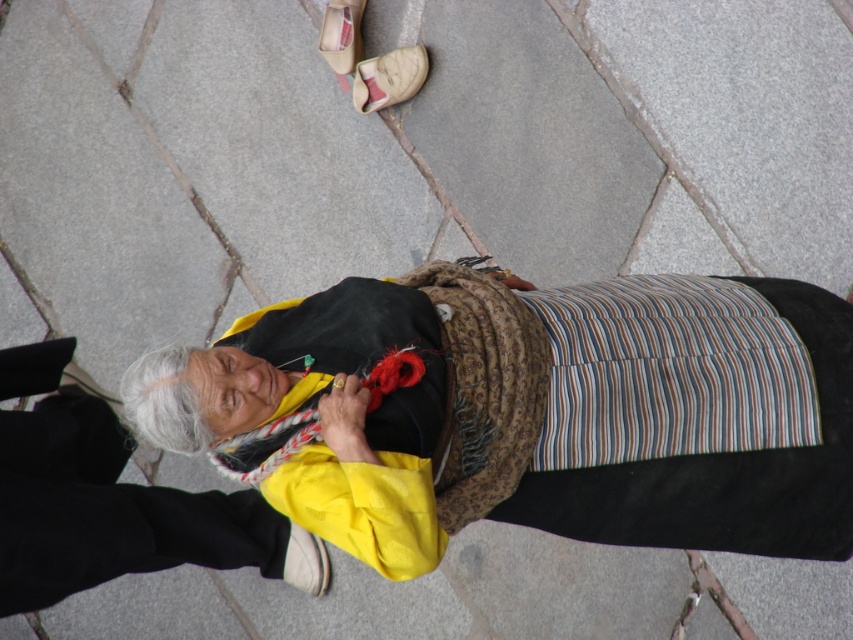
Question: Can you confirm if yellow fabric scarf at center is positioned to the right of white leather sandal at upper center?

Choices:
 (A) no
 (B) yes

Answer: (B)

Question: Which point is closer to the camera?

Choices:
 (A) tap(360, 35)
 (B) tap(799, 316)

Answer: (B)

Question: Based on their relative distances, which object is nearer to the yellow fabric scarf at center?

Choices:
 (A) white leather sandal at upper center
 (B) beige fabric sandal at upper center

Answer: (B)

Question: Among these objects, which one is nearest to the camera?

Choices:
 (A) beige fabric sandal at upper center
 (B) white leather sandal at upper center

Answer: (A)

Question: Can you confirm if yellow fabric scarf at center is positioned below white leather sandal at upper center?

Choices:
 (A) yes
 (B) no

Answer: (A)

Question: Does yellow fabric scarf at center appear over beige fabric sandal at upper center?

Choices:
 (A) no
 (B) yes

Answer: (A)